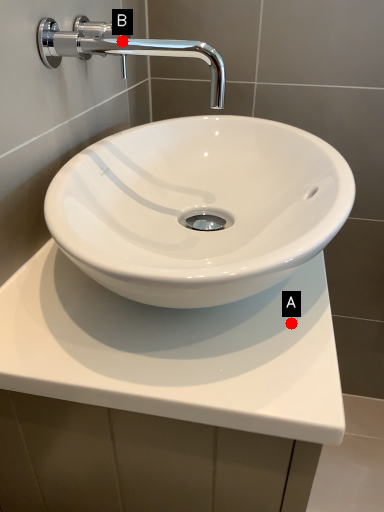
Question: Two points are circled on the image, labeled by A and B beside each circle. Which point is closer to the camera?

Choices:
 (A) A is closer
 (B) B is closer

Answer: (A)